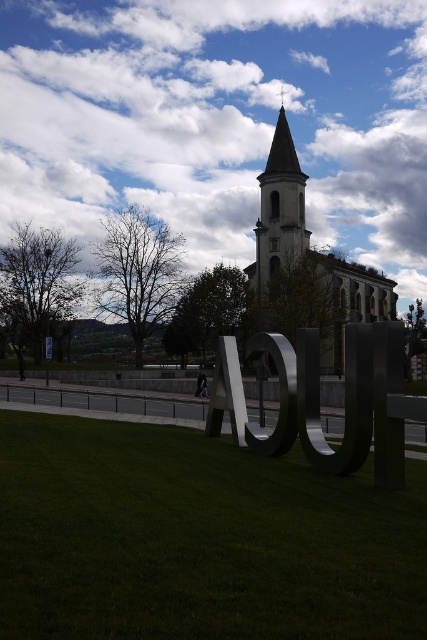
Is white stone church at center to the right of smooth stone bell tower at center from the viewer's perspective?

Correct, you'll find white stone church at center to the right of smooth stone bell tower at center.

Between white stone church at center and smooth stone bell tower at center, which one has less height?

With less height is smooth stone bell tower at center.

Does point (283, 166) come farther from viewer compared to point (271, 227)?

That is True.

At what (x,y) coordinates should I click in order to perform the action: click on white stone church at center. Please return your answer as a coordinate pair (x, y). Looking at the image, I should click on (280, 209).

Identify the location of green grass at lower center. (198, 538).

Can you confirm if green grass at lower center is positioned above smooth stone bell tower at center?

Incorrect, green grass at lower center is not positioned above smooth stone bell tower at center.

Is point (161, 516) more distant than point (289, 234)?

No, it is not.

Identify the location of green grass at lower center. (198, 538).

Is green grass at lower center bigger than white stone church at center?

No, green grass at lower center is not bigger than white stone church at center.

Does point (64, 618) lie in front of point (268, 260)?

Yes, it is in front of point (268, 260).

Identify the location of green grass at lower center. (198, 538).